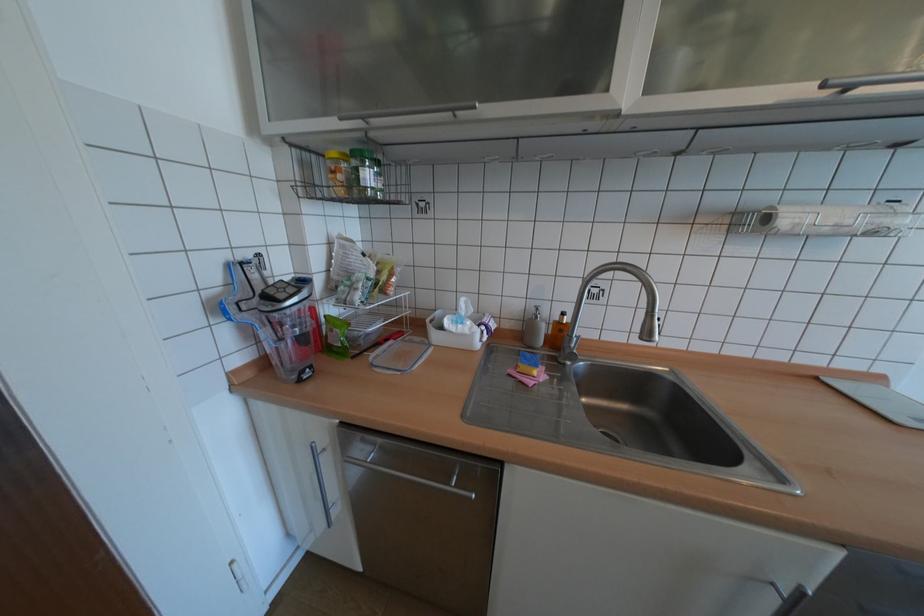
You are a GUI agent. You are given a task and a screenshot of the screen. Output one action in this format:
    pyautogui.click(x=<x>, y=<y>)
    Task: Click on the cabinet handle
    Image resolution: width=924 pixels, height=616 pixels.
    Given the screenshot: What is the action you would take?
    pyautogui.click(x=412, y=479)